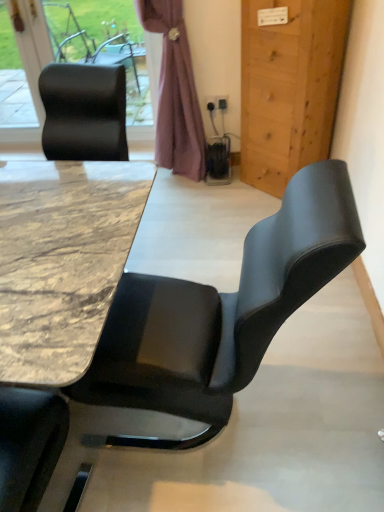
Question: Is point pyautogui.click(x=46, y=300) closer or farther from the camera than point pyautogui.click(x=155, y=154)?

Choices:
 (A) closer
 (B) farther

Answer: (A)

Question: Would you say marble/black at center is to the left or to the right of purple fabric curtain at upper center in the picture?

Choices:
 (A) right
 (B) left

Answer: (B)

Question: Which object is positioned closest to the marble/black at center?

Choices:
 (A) purple fabric curtain at upper center
 (B) wooden door at right
 (C) black leather chair at upper left
 (D) matte black chair at center

Answer: (D)

Question: Estimate the real-world distances between objects in this image. Which object is farther from the black leather chair at upper left?

Choices:
 (A) wooden door at right
 (B) marble/black at center
 (C) matte black chair at center
 (D) purple fabric curtain at upper center

Answer: (C)